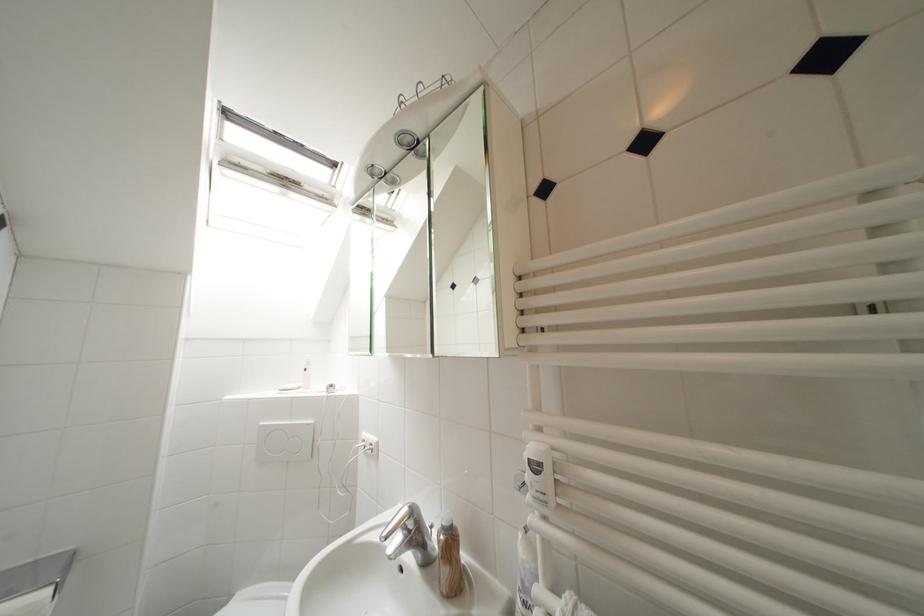
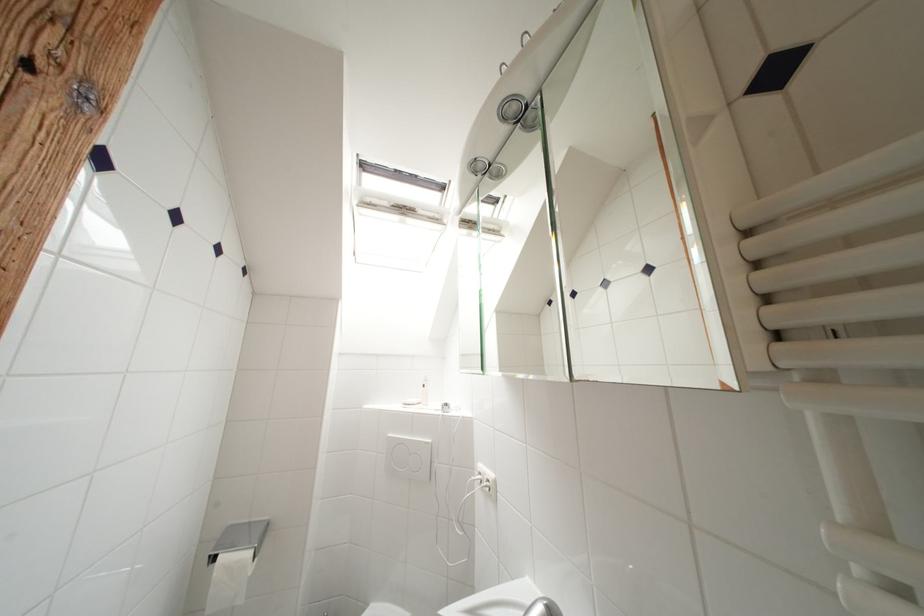
The images are taken continuously from a first-person perspective. In which direction are you moving?

The cameraman walked toward left, forward.